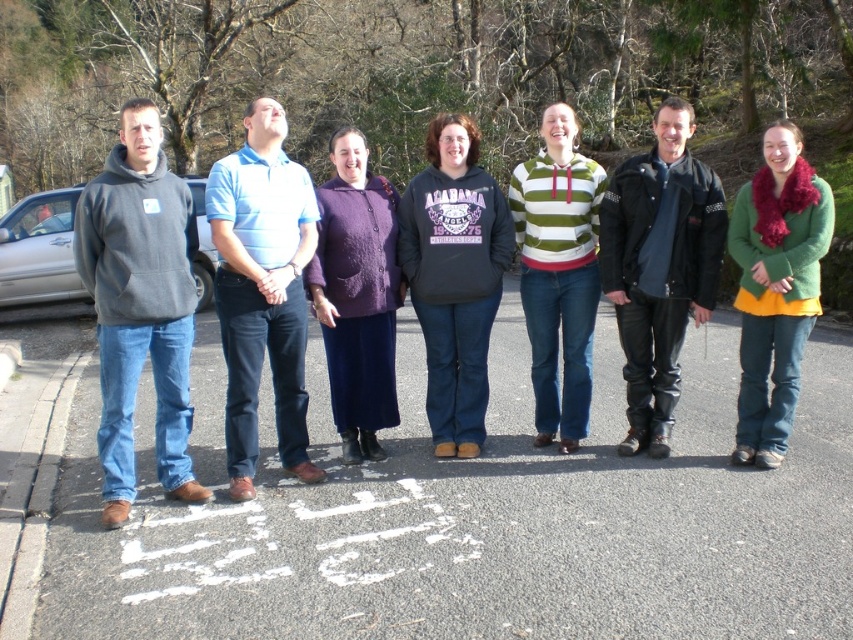
Can you confirm if striped knitwear at center is smaller than purple knitted sweater at center?

Incorrect, striped knitwear at center is not smaller in size than purple knitted sweater at center.

Is point (561, 451) positioned before point (375, 449)?

No.

This screenshot has width=853, height=640. Find the location of `striped knitwear at center`. striped knitwear at center is located at coordinates (558, 273).

Is point (141, 128) farther from camera compared to point (781, 195)?

That is False.

Is point (125, 449) behind point (798, 227)?

No.

This screenshot has width=853, height=640. Identify the location of matte gray hoodie at left. coord(140,305).

Which is behind, point (252, 458) or point (376, 412)?

The point (376, 412) is behind.

Where is `blue striped polo shirt at center`? This screenshot has height=640, width=853. blue striped polo shirt at center is located at coordinates (262, 291).

In order to click on blue striped polo shirt at center in this screenshot , I will do `click(262, 291)`.